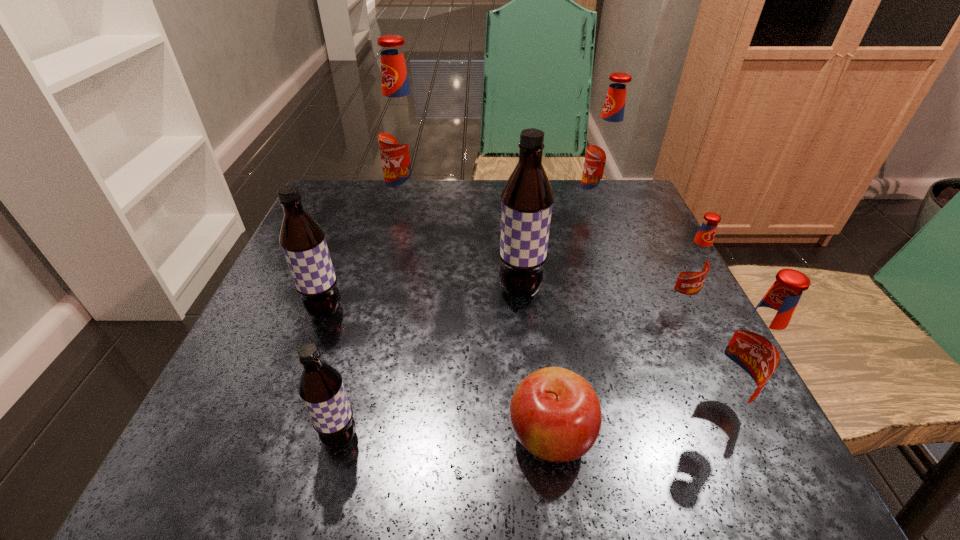
Find the location of a particular element. the leftmost red root beer is located at coordinates (401, 134).

Identify the location of the tallest root beer. Image resolution: width=960 pixels, height=540 pixels. (401, 134).

What are the coordinates of `the fifth root beer from left to right` in the screenshot? It's located at [606, 151].

Identify the location of the second biggest red root beer. This screenshot has height=540, width=960. [606, 151].

Where is `the biggest brown root beer`? This screenshot has height=540, width=960. the biggest brown root beer is located at coordinates (527, 199).

The width and height of the screenshot is (960, 540). Identify the location of the fourth root beer from left to right. (527, 199).

Where is `the leftmost root beer`? Image resolution: width=960 pixels, height=540 pixels. the leftmost root beer is located at coordinates (302, 239).

You are a GUI agent. You are given a task and a screenshot of the screen. Output one action in this format:
    pyautogui.click(x=<x>, y=<y>)
    Task: Click on the leftmost object
    
    Given the screenshot: What is the action you would take?
    pyautogui.click(x=302, y=239)

Where is `the third biggest red root beer`? The image size is (960, 540). the third biggest red root beer is located at coordinates (751, 351).

What are the coordinates of `the nearest brown root beer` in the screenshot? It's located at (321, 388).